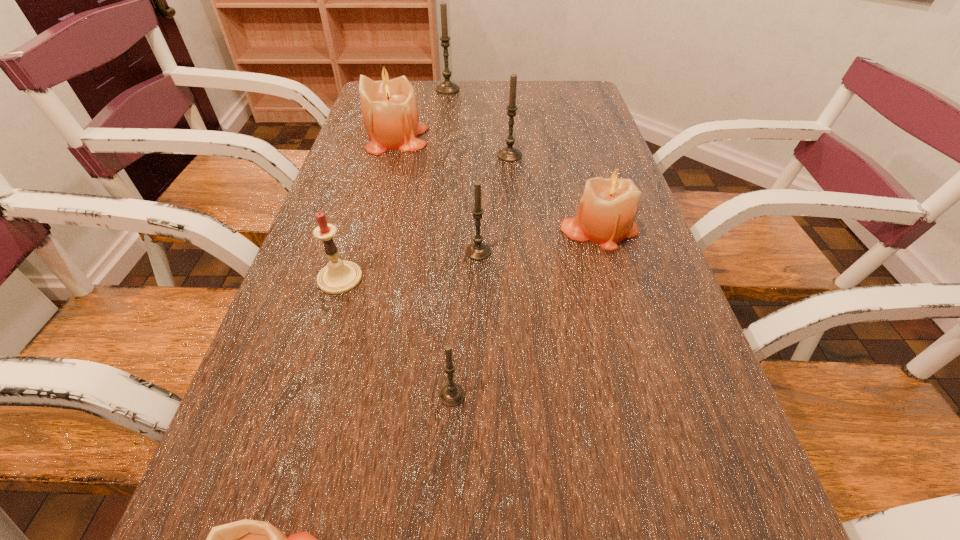
Identify the location of object present at the right edge. Image resolution: width=960 pixels, height=540 pixels. (609, 205).

You are a GUI agent. You are given a task and a screenshot of the screen. Output one action in this format:
    pyautogui.click(x=<x>, y=<y>)
    Task: Click on the vacant space at the far edge of the desktop
    The width and height of the screenshot is (960, 540).
    Given the screenshot: What is the action you would take?
    pyautogui.click(x=540, y=104)

At what (x,y) coordinates should I click in order to perform the action: click on vacant space at the left edge of the desktop. Please return your answer as a coordinate pair (x, y). The height and width of the screenshot is (540, 960). Looking at the image, I should click on (364, 219).

In order to click on vacant space at the right edge of the desktop in this screenshot , I will do `click(706, 482)`.

Identify the location of vacant space at the far right corner of the desktop. (597, 108).

Where is `empty space that is in between the farthest beige candle and the sixth farthest candle`? This screenshot has height=540, width=960. empty space that is in between the farthest beige candle and the sixth farthest candle is located at coordinates (369, 208).

This screenshot has height=540, width=960. What are the coordinates of `vacant area that lies between the second nearest gray candle and the farthest beige candle` in the screenshot? It's located at (438, 195).

I want to click on empty space that is in between the seventh farthest candle and the third biggest gray candle, so click(465, 323).

Locate an element on the screen. Image resolution: width=960 pixels, height=540 pixels. vacant region between the third biggest gray candle and the farthest gray candle is located at coordinates (463, 171).

Where is `empty location between the farthest gray candle and the biggest beige candle`? empty location between the farthest gray candle and the biggest beige candle is located at coordinates (422, 113).